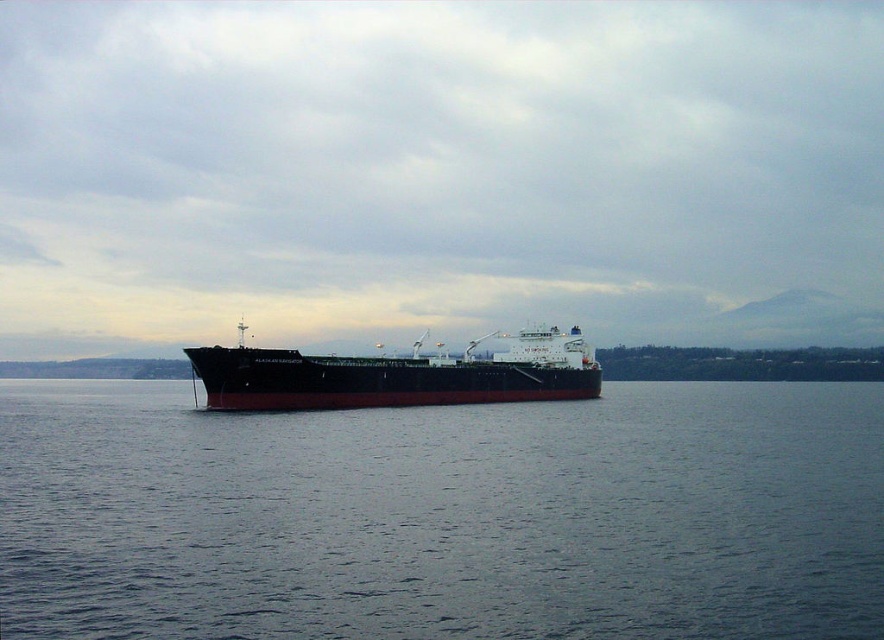
Question: Is dark blue water at center below black matte ship at center?

Choices:
 (A) yes
 (B) no

Answer: (A)

Question: Is dark blue water at center above black matte ship at center?

Choices:
 (A) no
 (B) yes

Answer: (A)

Question: Does dark blue water at center have a smaller size compared to black matte ship at center?

Choices:
 (A) yes
 (B) no

Answer: (B)